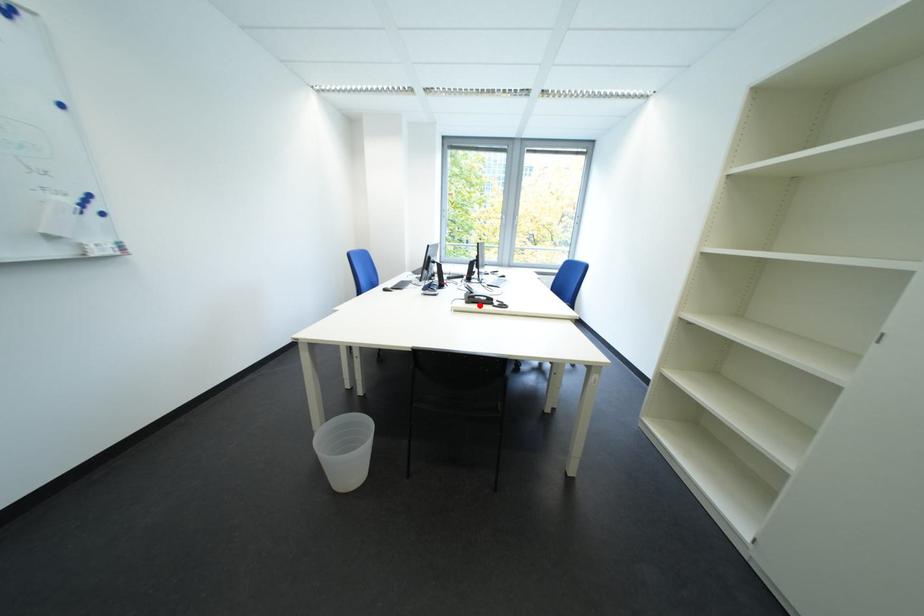
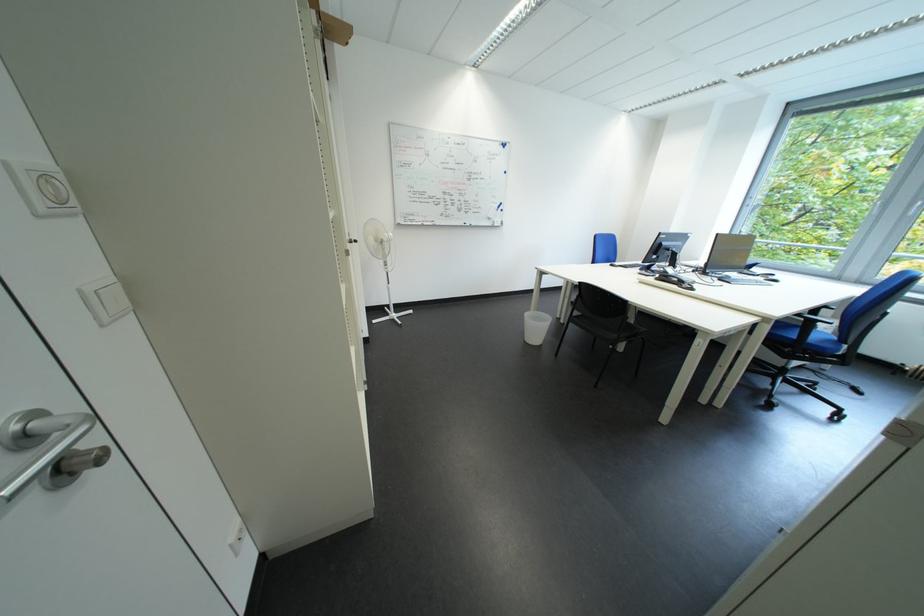
Question: I am providing you with two images of the same scene from different viewpoints. In image1, a red point is highlighted. Considering the same 3D point in image2, which of the following is correct?

Choices:
 (A) It is closer
 (B) It is farther

Answer: (A)